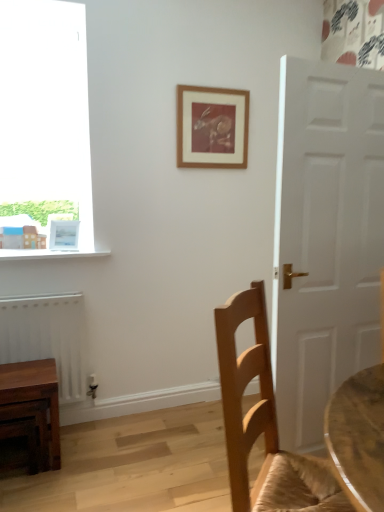
I want to click on free spot above wooden table at lower left (from a real-world perspective), so click(26, 369).